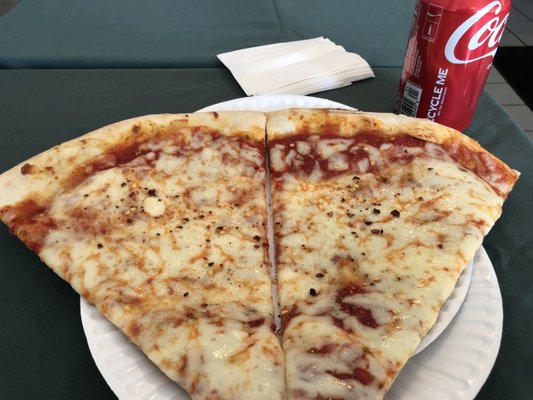
Identify the location of tile flooring. This screenshot has width=533, height=400. (508, 98), (521, 28).